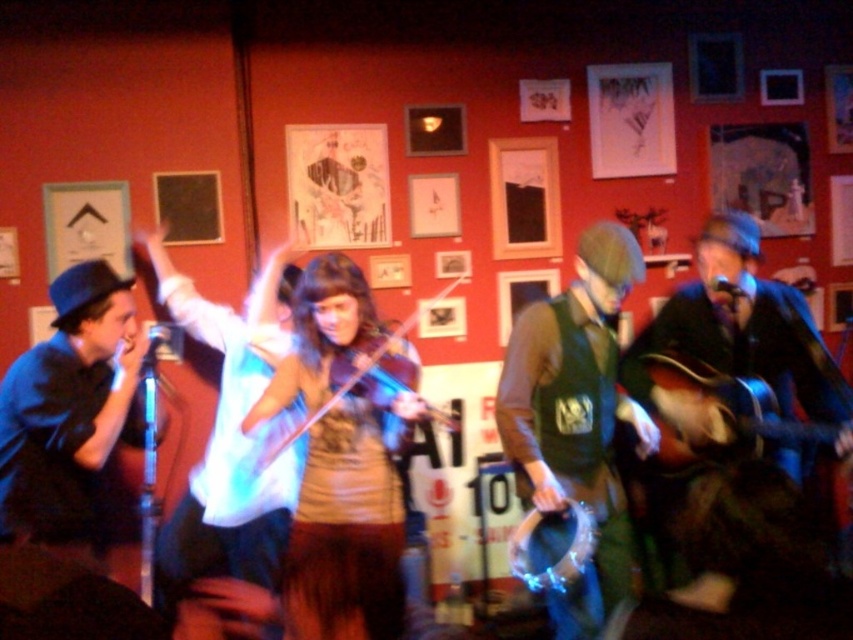
Looking at this image, you are a stagehand setting up a music stand for the performers. The stand is placed between the wooden acoustic guitar at right and the shiny brown violin at center. Which instrument should you place the music stand closer to to ensure it is within easy reach of both performers?

The music stand should be placed closer to the wooden acoustic guitar at right because it is shorter than the shiny brown violin at center, allowing both performers to access it comfortably.

You are a photographer in the audience at this music performance. You want to take a photo of both the wooden acoustic guitar at center and the shiny brown violin at center. Which instrument should you pan your camera to the right from to capture both?

You should pan your camera to the right from the shiny brown violin at center to capture both instruments, since the wooden acoustic guitar at center is located to the right of it.